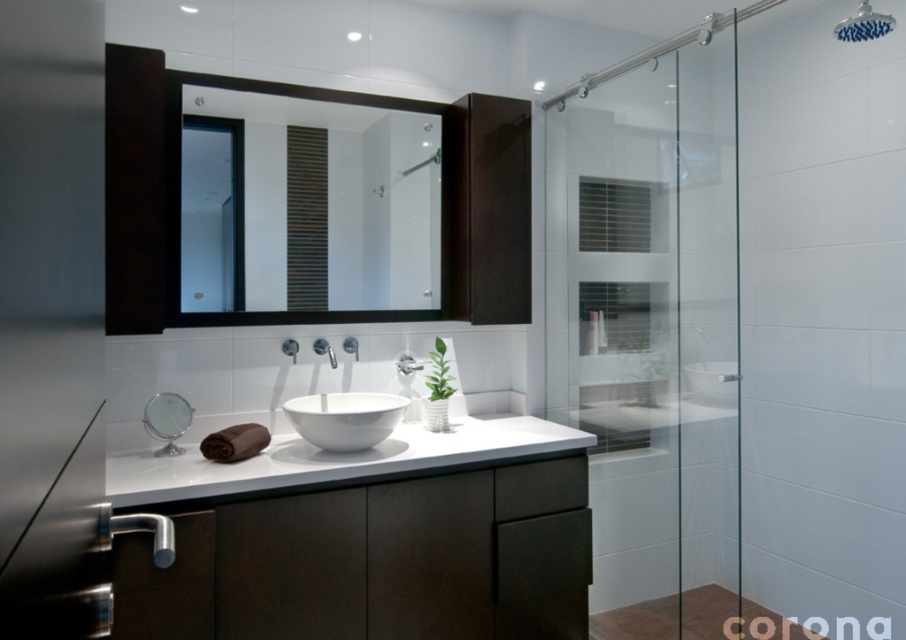
Question: Is matte black cabinet at left thinner than blue fabric shower head at upper center?

Choices:
 (A) no
 (B) yes

Answer: (A)

Question: Among these points, which one is nearest to the camera?

Choices:
 (A) (863, 33)
 (B) (406, 364)

Answer: (A)

Question: Is transparent glass shower door at right to the left of matte silver faucet at center from the viewer's perspective?

Choices:
 (A) yes
 (B) no

Answer: (B)

Question: Which of the following is the farthest from the observer?

Choices:
 (A) (88, 273)
 (B) (573, 184)
 (C) (330, 448)
 (D) (313, 340)

Answer: (B)

Question: Which of these objects is positioned closest to the transparent glass shower door at right?

Choices:
 (A) black matte mirror at upper center
 (B) blue fabric shower head at upper center

Answer: (A)

Question: Does transparent glass shower door at right have a greater width compared to white glossy faucet at center?

Choices:
 (A) yes
 (B) no

Answer: (A)